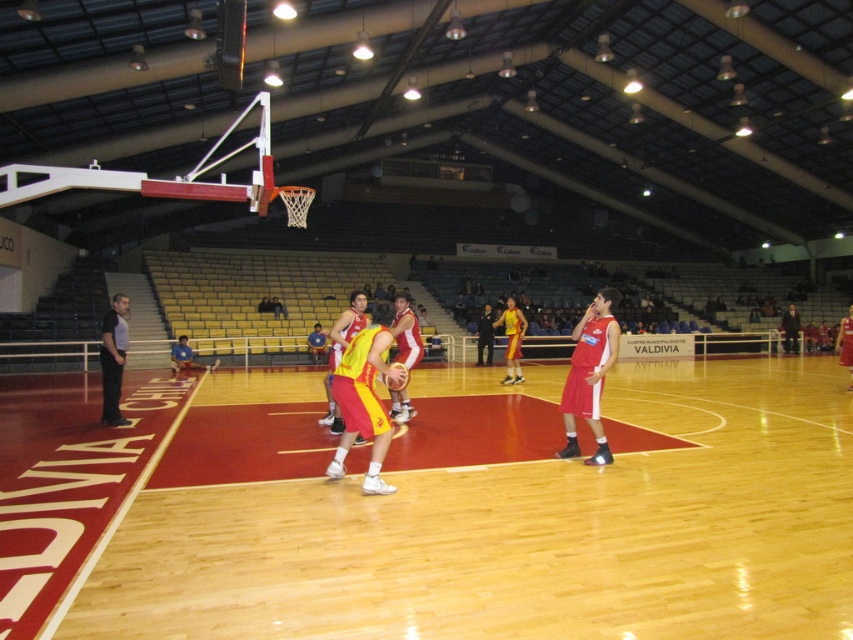
Question: From the image, what is the correct spatial relationship of wooden at center in relation to yellow matte basketball player at center?

Choices:
 (A) right
 (B) left

Answer: (B)

Question: Estimate the real-world distances between objects in this image. Which object is farther from the wooden at center?

Choices:
 (A) red jersey at center
 (B) matte red shorts at center

Answer: (A)

Question: Can you confirm if wooden at center is smaller than matte red shorts at center?

Choices:
 (A) yes
 (B) no

Answer: (A)

Question: Which of the following is the closest to the observer?

Choices:
 (A) red jersey at center
 (B) matte red shorts at center
 (C) yellow matte basketball at center

Answer: (C)

Question: Is wooden at center smaller than yellow jersey at center?

Choices:
 (A) yes
 (B) no

Answer: (B)

Question: Considering the real-world distances, which object is farthest from the yellow/red jersey at center?

Choices:
 (A) wooden at center
 (B) yellow matte basketball player at center
 (C) yellow matte basketball at center

Answer: (B)